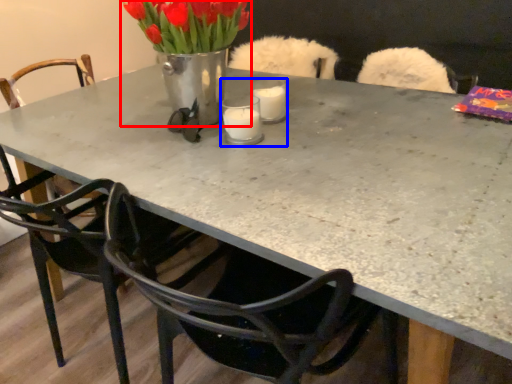
Question: Which object is closer to the camera taking this photo, floral arrangement (highlighted by a red box) or candle holder (highlighted by a blue box)?

Choices:
 (A) floral arrangement
 (B) candle holder

Answer: (A)